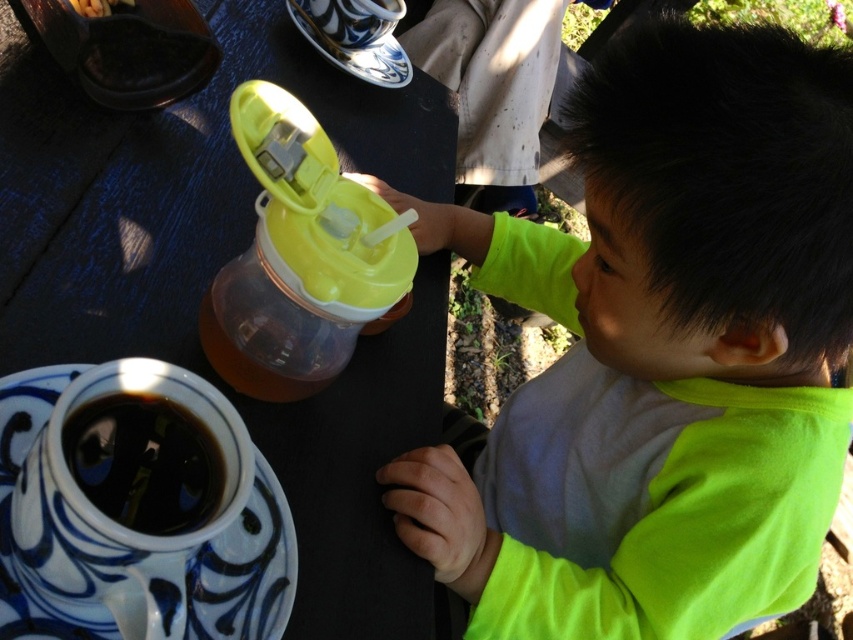
Question: Observing the image, what is the correct spatial positioning of black glossy table at center in reference to blue and white ceramic saucer at upper center?

Choices:
 (A) left
 (B) right

Answer: (A)

Question: Which point appears closest to the camera in this image?

Choices:
 (A) (425, 307)
 (B) (492, 637)

Answer: (B)

Question: Which point appears closest to the camera in this image?

Choices:
 (A) (140, 433)
 (B) (152, 625)
 (C) (349, 260)

Answer: (B)

Question: Is neon green shirt at center wider than dark glossy coffee cup at lower left?

Choices:
 (A) yes
 (B) no

Answer: (A)

Question: Is black glossy table at center in front of blue and white ceramic saucer at lower left?

Choices:
 (A) yes
 (B) no

Answer: (B)

Question: Based on their relative distances, which object is nearer to the dark glossy coffee cup at lower left?

Choices:
 (A) translucent plastic sippy cup at center
 (B) blue and white ceramic saucer at upper center
 (C) blue and white ceramic saucer at lower left
 (D) neon green shirt at center

Answer: (C)